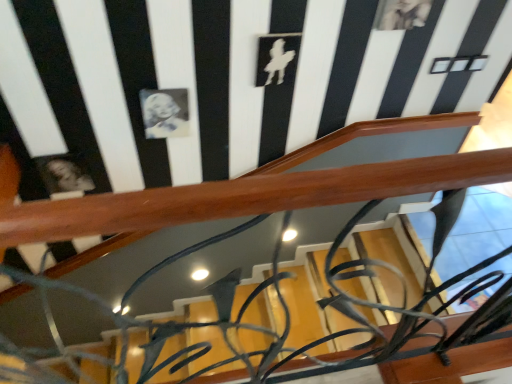
Question: Is matte black portrait at upper left, which is the second art from right to left, shorter than black glossy portrait at upper center, the first art in the right-to-left sequence?

Choices:
 (A) no
 (B) yes

Answer: (B)

Question: From the image's perspective, does matte black portrait at upper left, the second art positioned from the top, appear higher than black glossy portrait at upper center, which is counted as the second art, starting from the left?

Choices:
 (A) no
 (B) yes

Answer: (A)

Question: Can you confirm if matte black portrait at upper left, the 1th art when ordered from bottom to top, is thinner than black glossy portrait at upper center, which is the 2th art in bottom-to-top order?

Choices:
 (A) yes
 (B) no

Answer: (A)

Question: Does matte black portrait at upper left, the 1th art when ordered from bottom to top, have a smaller size compared to black glossy portrait at upper center, the 1th art from the top?

Choices:
 (A) no
 (B) yes

Answer: (A)

Question: Could black glossy portrait at upper center, the 1th art from the top, be considered to be inside matte black portrait at upper left, the 1th art when ordered from bottom to top?

Choices:
 (A) yes
 (B) no

Answer: (B)

Question: Is matte black portrait at upper left, the second art positioned from the top, in front of black glossy portrait at upper center, which is counted as the second art, starting from the left?

Choices:
 (A) yes
 (B) no

Answer: (B)

Question: Are black glossy portrait at upper center, which is the 2th art in bottom-to-top order, and matte black portrait at upper left, which is the second art from right to left, far apart?

Choices:
 (A) no
 (B) yes

Answer: (A)

Question: Can you confirm if black glossy portrait at upper center, the first art in the right-to-left sequence, is smaller than matte black portrait at upper left, which is the first art from left to right?

Choices:
 (A) yes
 (B) no

Answer: (A)

Question: From a real-world perspective, is black glossy portrait at upper center, which is the 2th art in bottom-to-top order, located beneath matte black portrait at upper left, which is the first art from left to right?

Choices:
 (A) yes
 (B) no

Answer: (B)

Question: Is black glossy portrait at upper center, the first art in the right-to-left sequence, positioned with its back to matte black portrait at upper left, which is the second art from right to left?

Choices:
 (A) no
 (B) yes

Answer: (A)

Question: Could you tell me if black glossy portrait at upper center, which is the 2th art in bottom-to-top order, is facing matte black portrait at upper left, which is the second art from right to left?

Choices:
 (A) no
 (B) yes

Answer: (A)

Question: Can you confirm if black glossy portrait at upper center, the first art in the right-to-left sequence, is taller than matte black portrait at upper left, which is the second art from right to left?

Choices:
 (A) yes
 (B) no

Answer: (A)

Question: In terms of size, does matte black portrait at upper left, the second art positioned from the top, appear bigger or smaller than black glossy portrait at upper center, which is counted as the second art, starting from the left?

Choices:
 (A) small
 (B) big

Answer: (B)